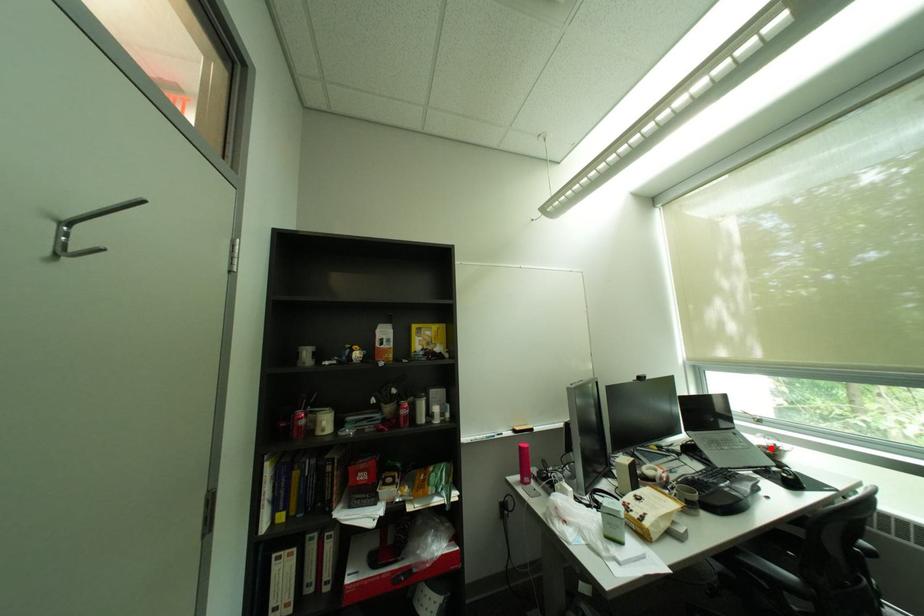
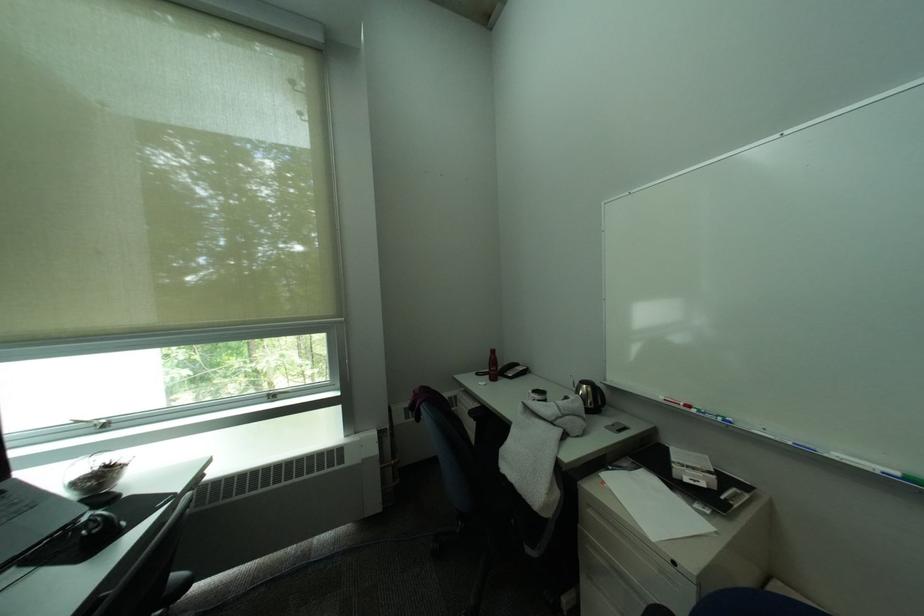
The point at the highlighted location is marked in the first image. Where is the corresponding point in the second image?

(84, 485)